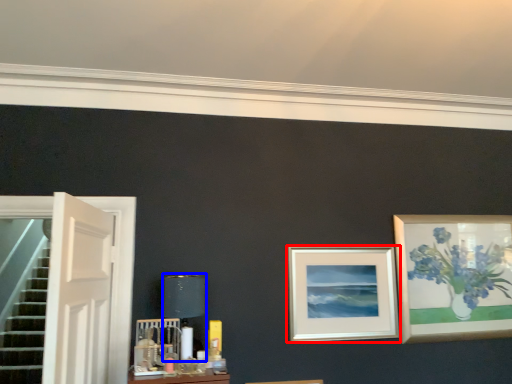
Question: Which point is closer to the camera, picture frame (highlighted by a red box) or table lamp (highlighted by a blue box)?

Choices:
 (A) picture frame
 (B) table lamp

Answer: (B)